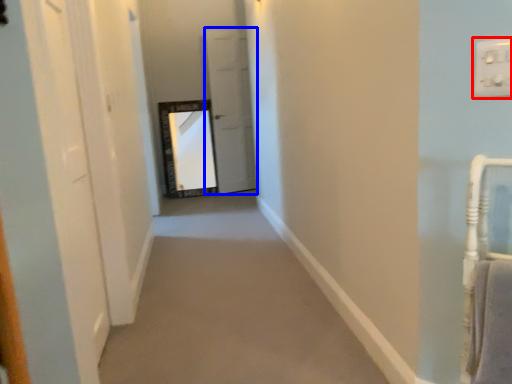
Question: Which object is closer to the camera taking this photo, electric outlet (highlighted by a red box) or door (highlighted by a blue box)?

Choices:
 (A) electric outlet
 (B) door

Answer: (A)